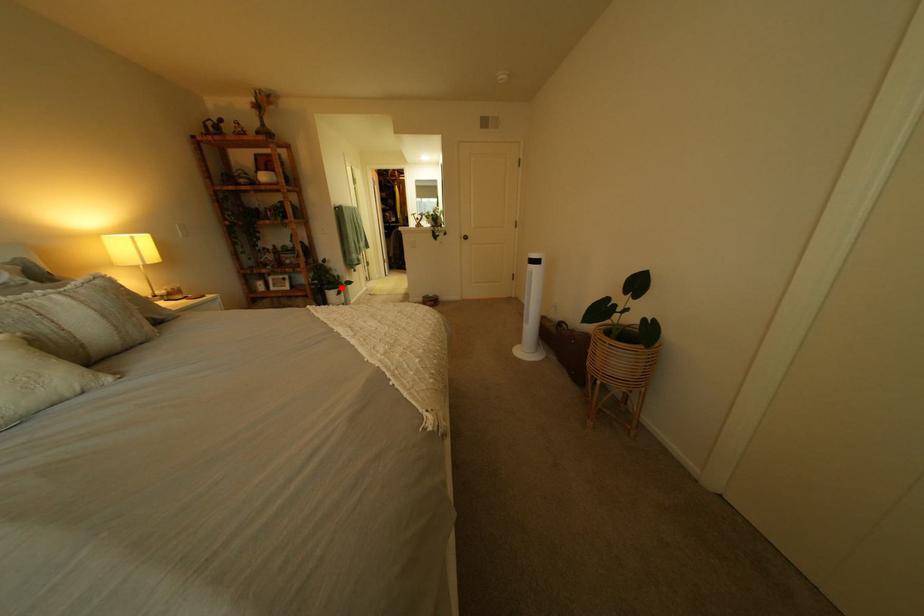
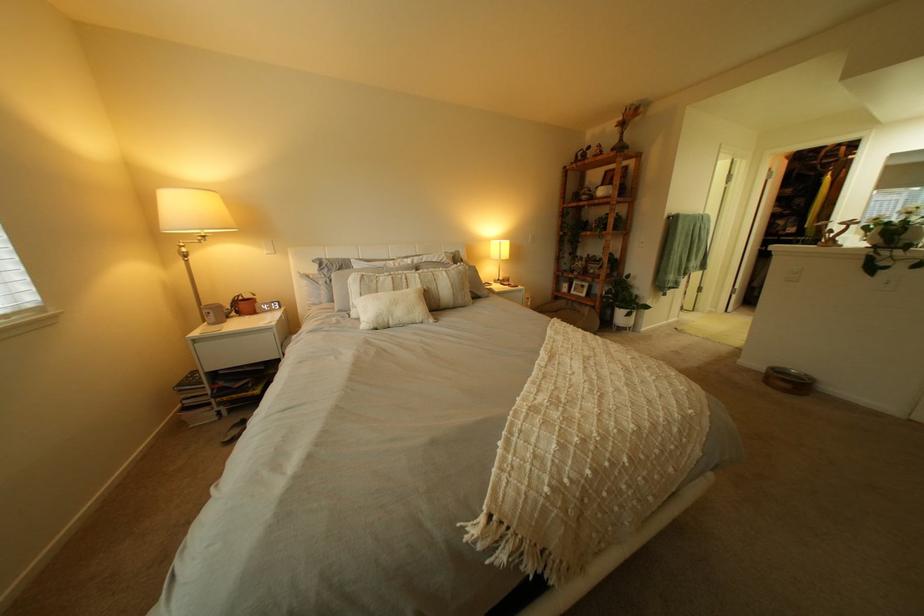
Question: I am providing you with two images of the same scene from different viewpoints. A red point is shown in image1. For the corresponding object point in image2, is it positioned nearer or farther from the camera?

Choices:
 (A) Nearer
 (B) Farther

Answer: (B)